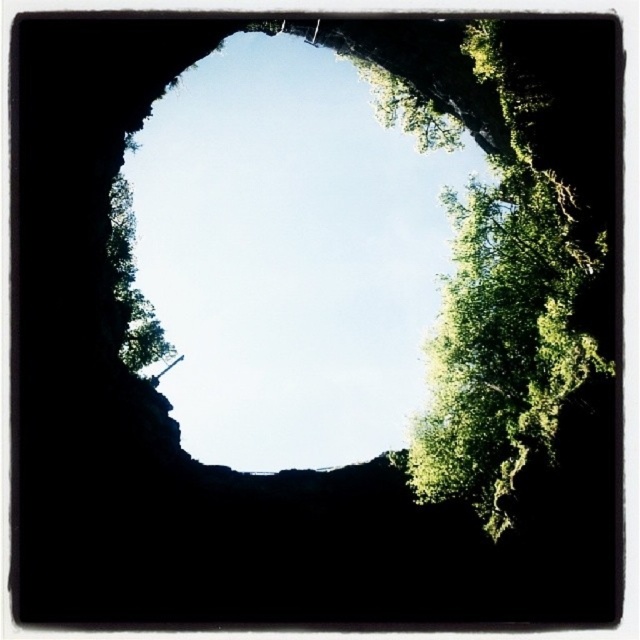
Question: Among these points, which one is nearest to the camera?

Choices:
 (A) (132, 368)
 (B) (400, 208)

Answer: (A)

Question: Estimate the real-world distances between objects in this image. Which object is farther from the transparent glass hole at center?

Choices:
 (A) green leafy tree at left
 (B) green leafy tree at upper right

Answer: (A)

Question: Is transparent glass hole at center wider than green leafy tree at upper right?

Choices:
 (A) yes
 (B) no

Answer: (A)

Question: Can you confirm if green leafy tree at upper right is positioned below green leafy tree at left?

Choices:
 (A) yes
 (B) no

Answer: (A)

Question: Which of these objects is positioned closest to the green leafy tree at upper right?

Choices:
 (A) green leafy tree at left
 (B) transparent glass hole at center

Answer: (A)

Question: Can you confirm if green leafy tree at upper right is positioned to the left of green leafy tree at left?

Choices:
 (A) no
 (B) yes

Answer: (A)